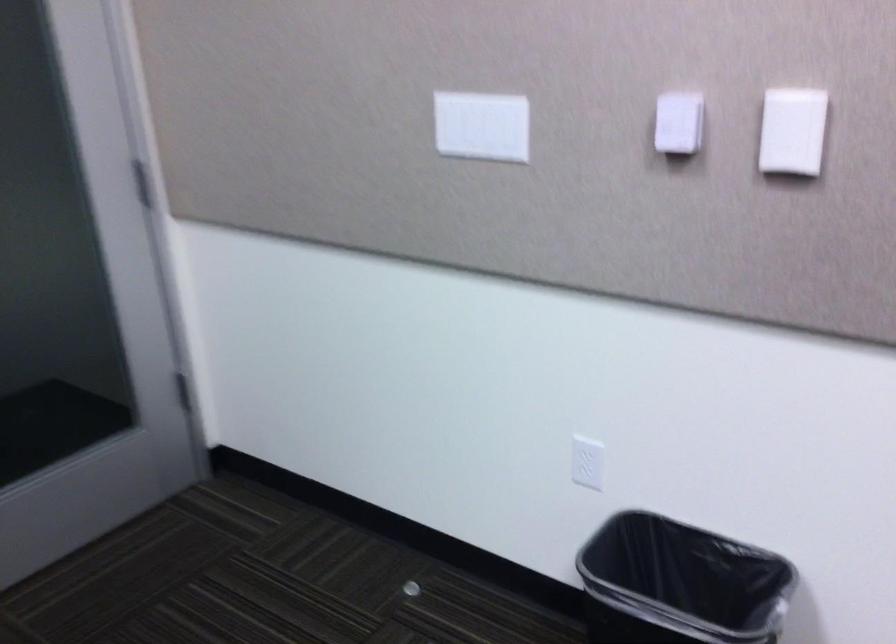
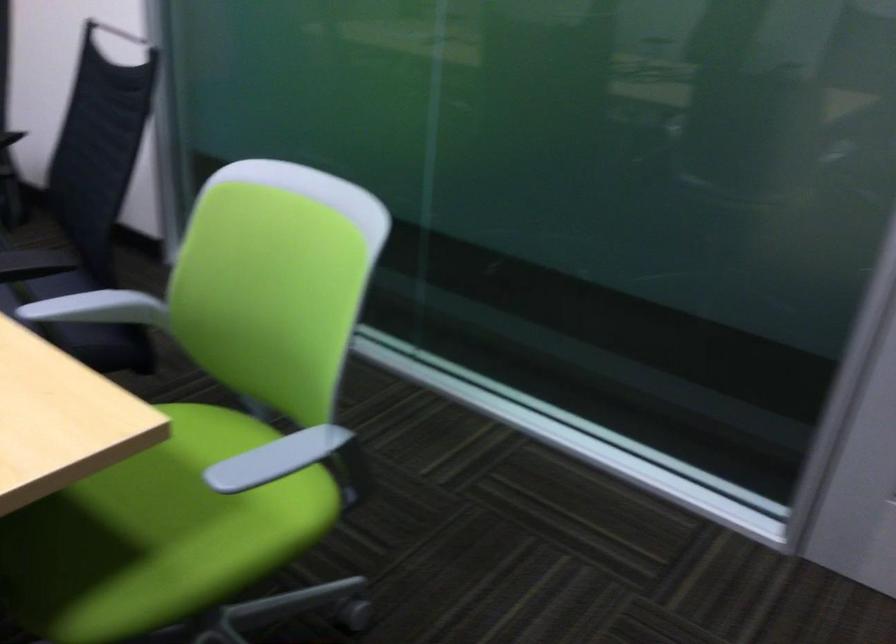
First-person continuous shooting, in which direction is the camera rotating?

The camera's rotation is toward left-down.